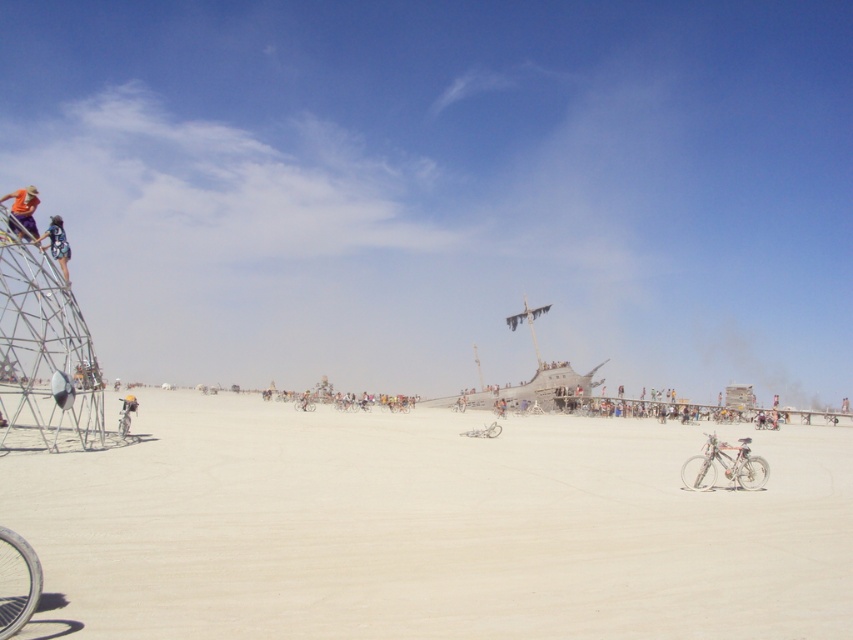
Measure the distance between white sand dirt track at center and camera.

white sand dirt track at center and camera are 9.32 meters apart from each other.

Does point (263, 547) come in front of point (48, 244)?

Yes, it is in front of point (48, 244).

At what (x,y) coordinates should I click in order to perform the action: click on white sand dirt track at center. Please return your answer as a coordinate pair (x, y). Looking at the image, I should click on (428, 528).

Between silver metallic bicycle at lower right and blue denim shorts at left, which one appears on the right side from the viewer's perspective?

silver metallic bicycle at lower right

Which is in front, point (752, 483) or point (59, 259)?

Point (752, 483)

Find the location of a particular element. The width and height of the screenshot is (853, 640). silver metallic bicycle at lower right is located at coordinates (724, 465).

Does silver metallic bicycle at lower right appear over silver metallic bicycle at lower left?

Incorrect, silver metallic bicycle at lower right is not positioned above silver metallic bicycle at lower left.

Between silver metallic bicycle at lower right and silver metallic bicycle at lower left, which one has more height?

With more height is silver metallic bicycle at lower right.

This screenshot has width=853, height=640. What do you see at coordinates (724, 465) in the screenshot?
I see `silver metallic bicycle at lower right` at bounding box center [724, 465].

Find the location of a particular element. silver metallic bicycle at lower right is located at coordinates (724, 465).